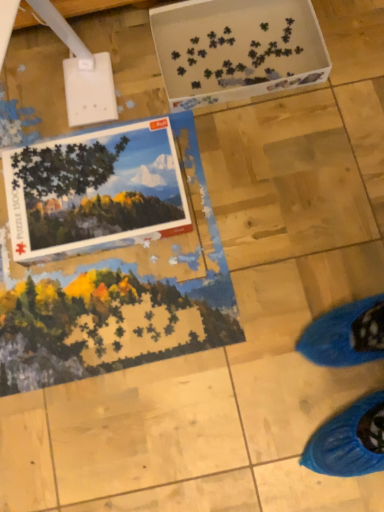
Locate an element on the screen. Image resolution: width=384 pixels, height=512 pixels. free space above matte cardboard puzzle box at upper left (from a real-world perspective) is located at coordinates (94, 177).